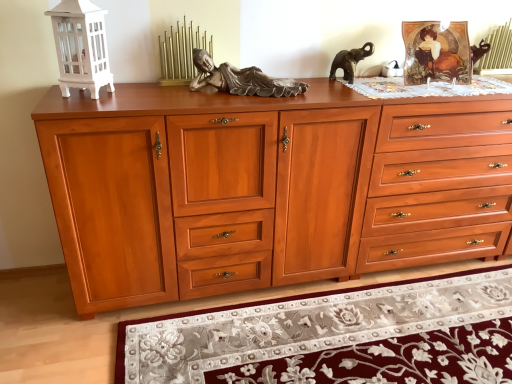
Question: Is point (382, 301) closer or farther from the camera than point (247, 122)?

Choices:
 (A) farther
 (B) closer

Answer: (A)

Question: From the image's perspective, relative to satin wood drawer at center, the 2th drawer from the right, is floral rug at lower center above or below?

Choices:
 (A) above
 (B) below

Answer: (B)

Question: Based on their relative distances, which object is farther from the cherry wood chest of drawers at center?

Choices:
 (A) floral rug at lower center
 (B) satin wood drawer at center, arranged as the first drawer when viewed from the left
 (C) satin wood drawer at right, which is the 1th drawer from right to left

Answer: (A)

Question: Which object is the closest to the cherry wood chest of drawers at center?

Choices:
 (A) satin wood drawer at right, which is the 1th drawer from right to left
 (B) floral rug at lower center
 (C) satin wood drawer at center, arranged as the first drawer when viewed from the left

Answer: (C)